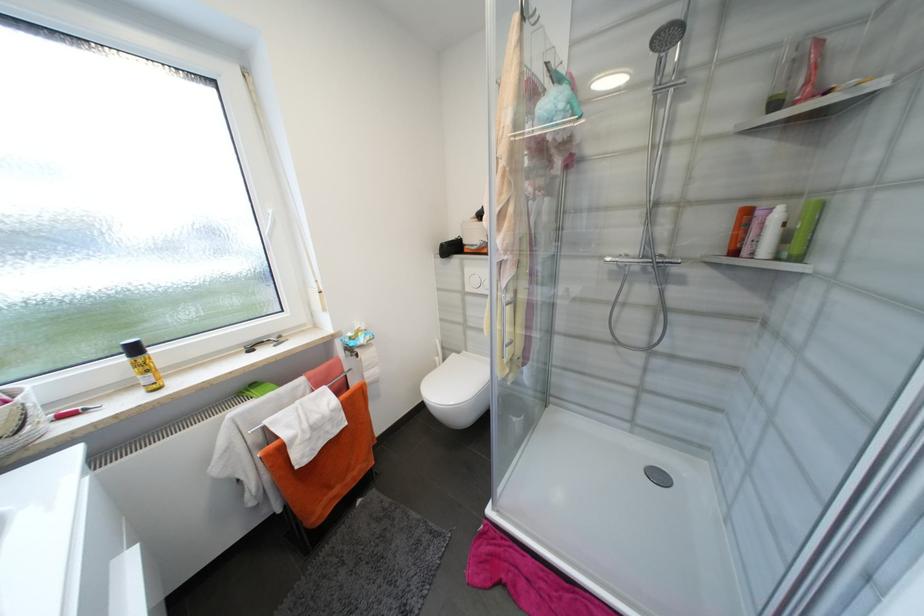
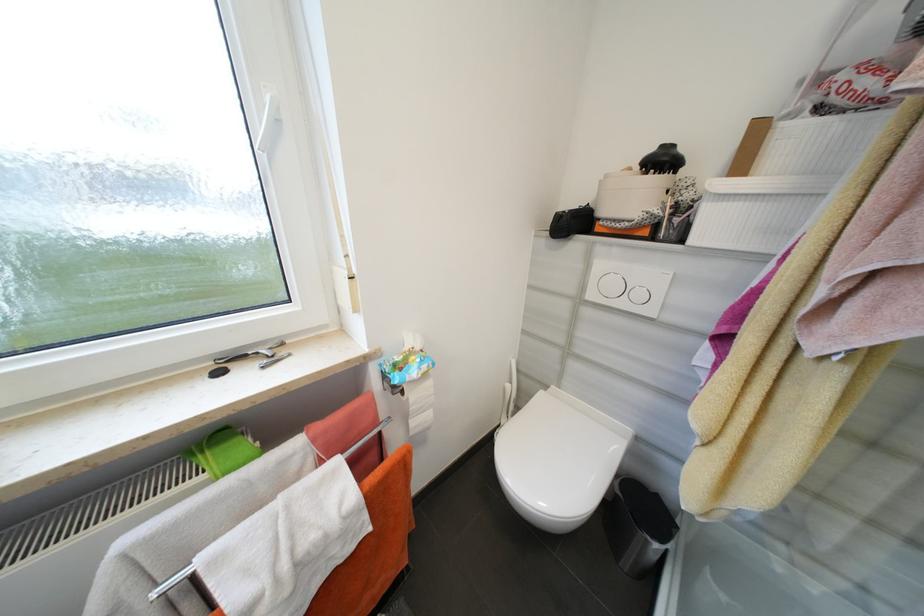
Question: The images are taken continuously from a first-person perspective. In which direction is your viewpoint rotating?

Choices:
 (A) Left
 (B) Right
 (C) Up
 (D) Down

Answer: (A)